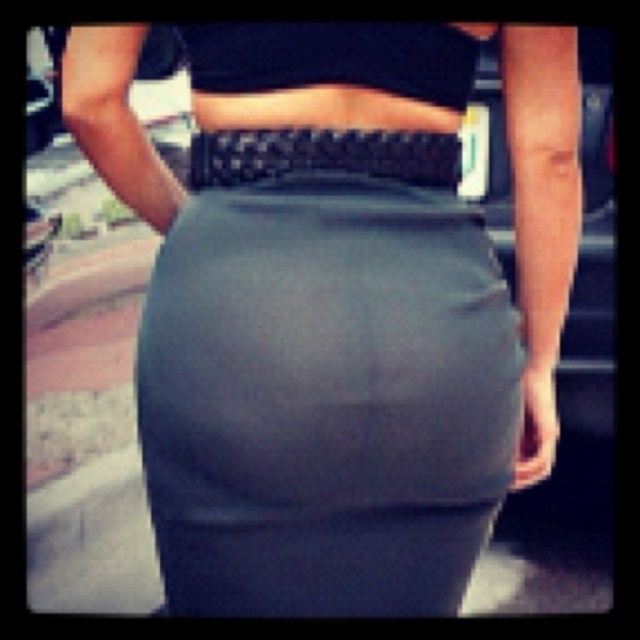
You are a fashion designer analyzing a photo of a person wearing a black matte crop top at upper center and a black woven belt at center. Which piece of clothing is positioned closer to the front of the outfit?

The black matte crop top at upper center is positioned closer to the front of the outfit since it is in front of the black woven belt at center.

You are standing in a park and see two points marked on a railing in front of you. The points are labeled as point [204,38] and point [234,164]. Which point is closer to you?

Point [204,38] is closer to the viewer than point [234,164].

You are a fashion designer reviewing a client outfit. The client is wearing a black matte crop top at upper center and a black woven belt at center. Which piece of clothing is covering the other?

The black matte crop top at upper center is positioned over the black woven belt at center, so the crop top is covering the belt.